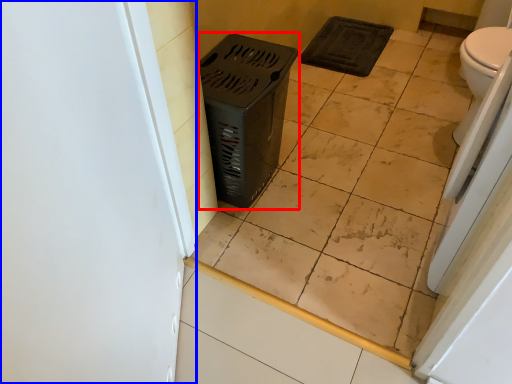
Question: Which of the following is the farthest to the observer, laundry basket (highlighted by a red box) or screen door (highlighted by a blue box)?

Choices:
 (A) laundry basket
 (B) screen door

Answer: (A)